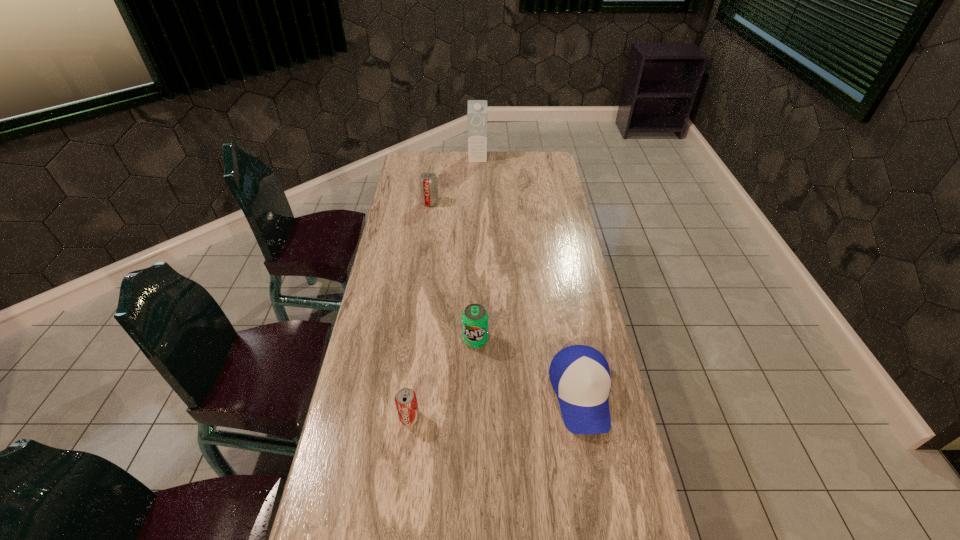
The height and width of the screenshot is (540, 960). What are the coordinates of `free space located on the front-facing side of the baseball cap` in the screenshot? It's located at (595, 471).

You are a GUI agent. You are given a task and a screenshot of the screen. Output one action in this format:
    pyautogui.click(x=<x>, y=<y>)
    Task: Click on the free space located 0.130m on the back of the nearest soda can
    
    Given the screenshot: What is the action you would take?
    click(416, 367)

Locate an element on the screen. This screenshot has width=960, height=540. object that is positioned at the far edge is located at coordinates (477, 109).

Locate an element on the screen. Image resolution: width=960 pixels, height=540 pixels. object that is at the right edge is located at coordinates (579, 374).

Find the location of a particular element. This screenshot has height=540, width=960. free location at the far edge of the desktop is located at coordinates (490, 158).

Find the location of a particular element. The height and width of the screenshot is (540, 960). free location at the left edge of the desktop is located at coordinates (348, 408).

You are a GUI agent. You are given a task and a screenshot of the screen. Output one action in this format:
    pyautogui.click(x=<x>, y=<y>)
    Task: Click on the vacant space at the right edge
    The image size is (960, 540).
    Given the screenshot: What is the action you would take?
    pyautogui.click(x=537, y=261)

In order to click on vacant space at the far right corner in this screenshot , I will do `click(545, 157)`.

Locate an element on the screen. The height and width of the screenshot is (540, 960). free spot between the farthest soda can and the carton is located at coordinates (454, 180).

Identify the location of empty space that is in between the fourth nearest object and the farthest object. (454, 180).